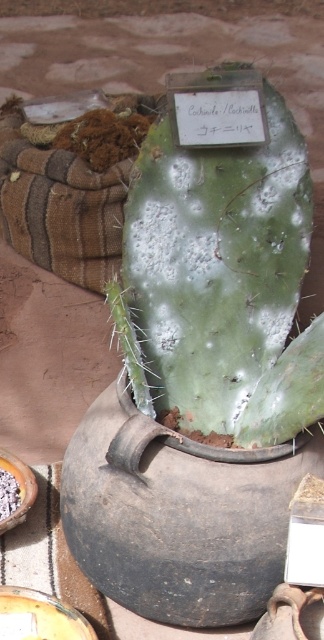
Question: Observing the image, what is the correct spatial positioning of green matte cactus at center in reference to white crumbly food at lower left?

Choices:
 (A) below
 (B) above

Answer: (B)

Question: Is green matte cactus at center positioned behind white crumbly food at lower left?

Choices:
 (A) yes
 (B) no

Answer: (B)

Question: Can you confirm if green matte cactus at center is positioned below white crumbly food at lower left?

Choices:
 (A) no
 (B) yes

Answer: (A)

Question: Which object appears closest to the camera in this image?

Choices:
 (A) green matte cactus at center
 (B) white crumbly food at lower left

Answer: (A)